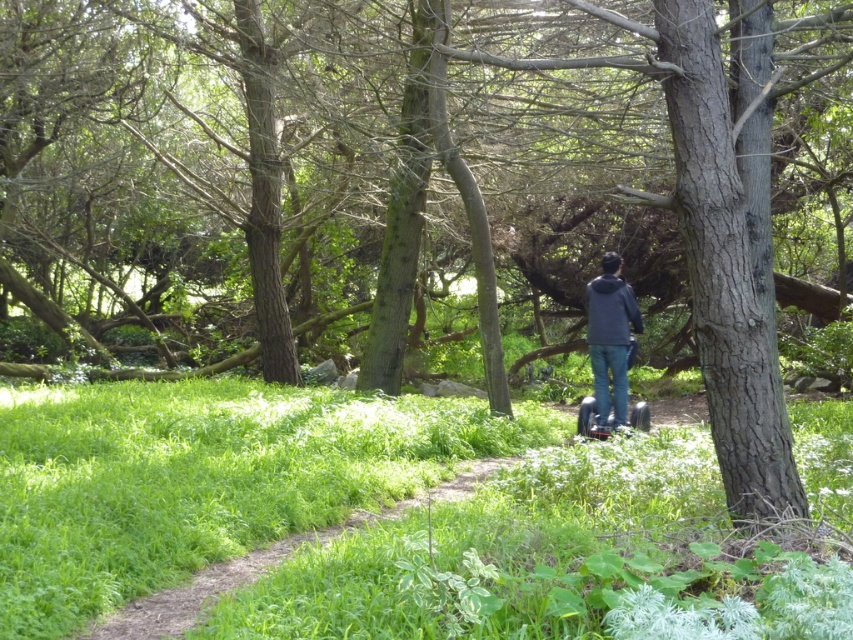
You are standing at the point labeled as point (x=201, y=477) in the forest scene. What type of terrain are you currently standing on?

You are standing on green grass at center, as the point (x=201, y=477) corresponds to that terrain.

You are standing at the edge of the forest and see the green grass at center and the dark gray hoodie at center. Which object is nearer to you?

The green grass at center is closer to the viewer than the dark gray hoodie at center, so the green grass at center is nearer.

You are standing at the starting point of the dirt path in the forest scene. You need to reach the person on the Segway wearing the dark gray hoodie at center. The path is narrow and only 2 meters wide. Can you walk straight along the path to reach them without stepping on the green grass at center?

The distance between the green grass at center and the dark gray hoodie at center is 4.04 meters. Since the path is 2 meters wide, you can walk straight along the path without stepping on the green grass at center as the path width allows safe passage.